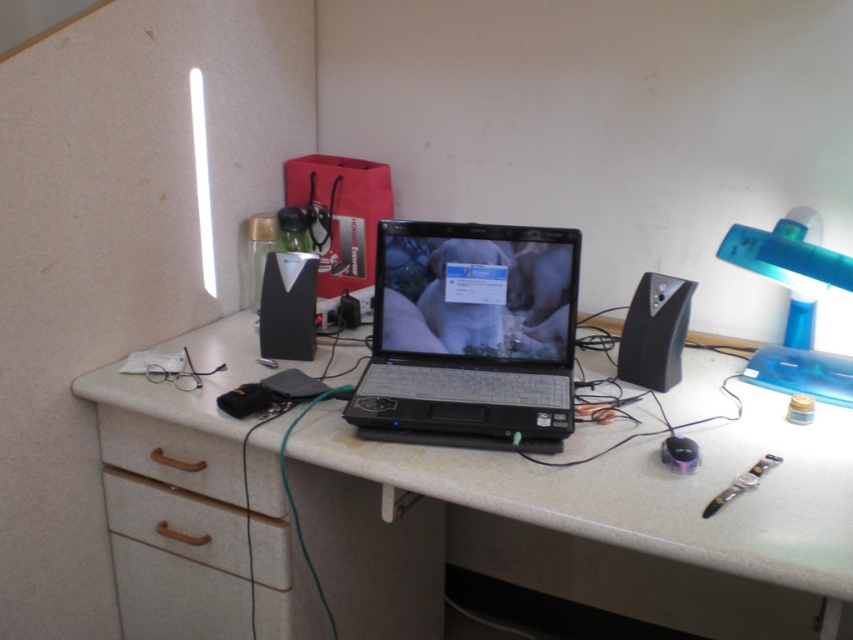
Question: Which point is farther to the camera?

Choices:
 (A) (480, 346)
 (B) (267, 580)

Answer: (A)

Question: Does wooden drawer at lower left appear on the left side of brown wood drawer at lower left?

Choices:
 (A) yes
 (B) no

Answer: (A)

Question: Is white laminate table at center below blue translucent lamp at right?

Choices:
 (A) no
 (B) yes

Answer: (B)

Question: Which of the following is the farthest from the observer?

Choices:
 (A) blue translucent lamp at right
 (B) brown wood drawer at lower left
 (C) wooden drawer at lower left

Answer: (C)

Question: Can you confirm if black plastic laptop at center is positioned above blue translucent lamp at right?

Choices:
 (A) yes
 (B) no

Answer: (B)

Question: Which of the following is the closest to the observer?

Choices:
 (A) black plastic laptop at center
 (B) white laminate table at center
 (C) brown wood drawer at lower left

Answer: (B)